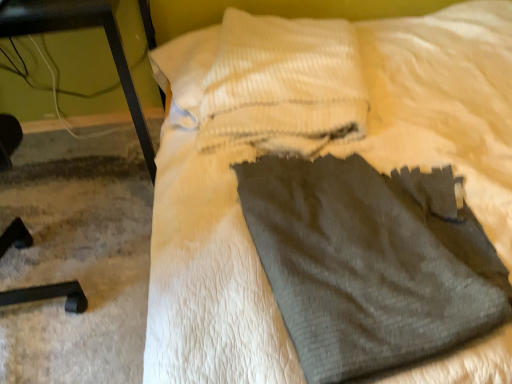
Question: From a real-world perspective, is gray fabric at center physically located above or below black metal table at left?

Choices:
 (A) below
 (B) above

Answer: (A)

Question: Looking at the image, does gray fabric at center seem bigger or smaller compared to black metal table at left?

Choices:
 (A) big
 (B) small

Answer: (A)

Question: Estimate the real-world distances between objects in this image. Which object is farther from the gray fabric at center?

Choices:
 (A) white textured pillow at upper center
 (B) black metal table at left
 (C) dark gray fabric sweat pants at center

Answer: (B)

Question: Which object is positioned closest to the gray fabric at center?

Choices:
 (A) dark gray fabric sweat pants at center
 (B) white textured pillow at upper center
 (C) black metal table at left

Answer: (B)